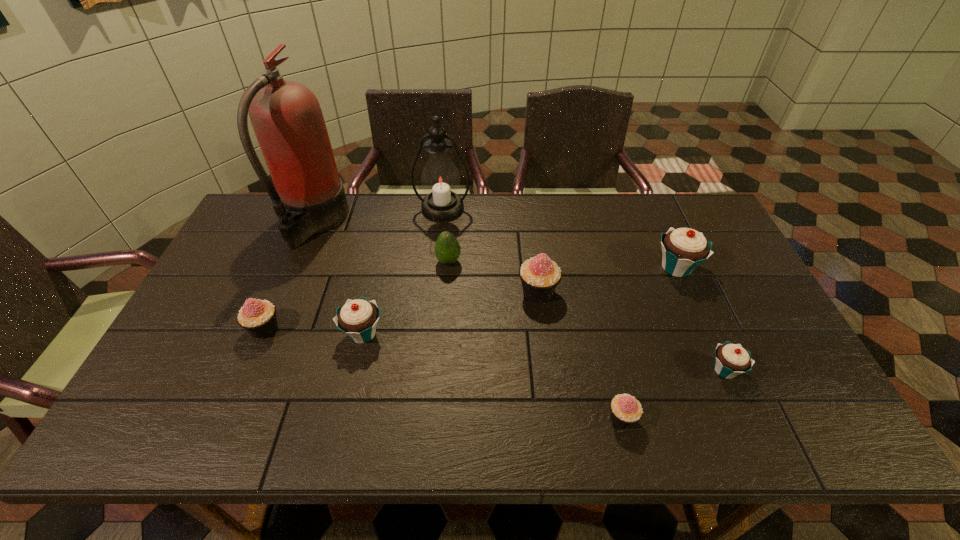
Find the location of a particular element. The width and height of the screenshot is (960, 540). vacant space positioned on the left of the second nearest teal cupcake is located at coordinates (251, 333).

You are a GUI agent. You are given a task and a screenshot of the screen. Output one action in this format:
    pyautogui.click(x=<x>, y=<y>)
    Task: Click on the free region located 0.230m on the right of the green avocado
    The image size is (960, 540).
    Given the screenshot: What is the action you would take?
    pyautogui.click(x=536, y=261)

Find the location of `free location located 0.050m on the left of the smallest teal cupcake`. free location located 0.050m on the left of the smallest teal cupcake is located at coordinates (687, 370).

The image size is (960, 540). I want to click on vacant space located on the back of the smallest pink cupcake, so click(x=593, y=300).

You are a GUI agent. You are given a task and a screenshot of the screen. Output one action in this format:
    pyautogui.click(x=<x>, y=<y>)
    Task: Click on the fire extinguisher that is at the far edge
    
    Given the screenshot: What is the action you would take?
    pyautogui.click(x=287, y=119)

The width and height of the screenshot is (960, 540). In order to click on oil lamp present at the far edge in this screenshot , I will do `click(440, 179)`.

Where is `object located in the near edge section of the desktop`? object located in the near edge section of the desktop is located at coordinates (626, 410).

Find the location of a particular element. object that is positioned at the left edge is located at coordinates (287, 119).

Locate an element on the screen. The height and width of the screenshot is (540, 960). object that is positioned at the far left corner is located at coordinates (287, 119).

Locate an element on the screen. free space at the far edge is located at coordinates (419, 221).